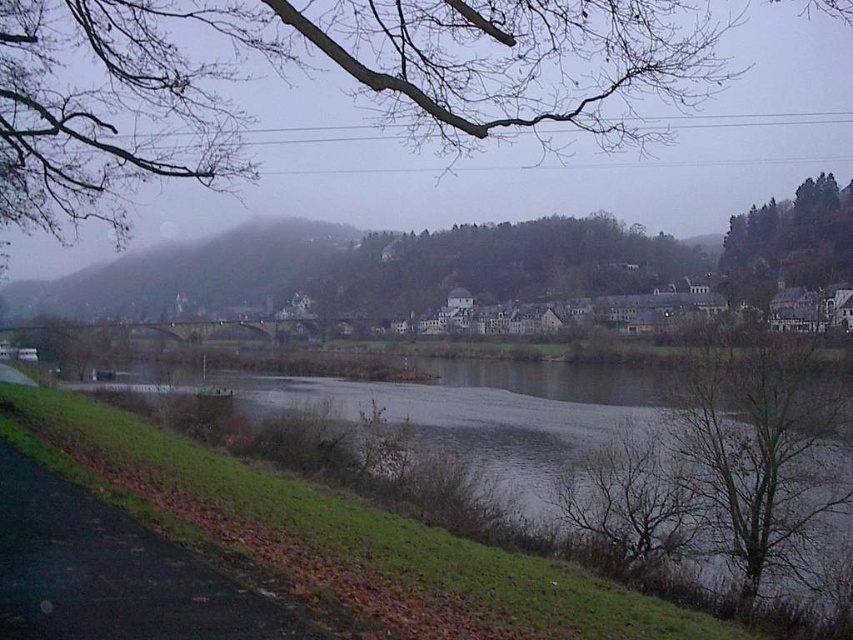
Question: Among these points, which one is nearest to the camera?

Choices:
 (A) (560, 452)
 (B) (848, 269)
 (C) (683, 472)
 (D) (39, 131)

Answer: (D)

Question: Does gray smooth water at lower left appear on the left side of bare branches at lower right?

Choices:
 (A) no
 (B) yes

Answer: (B)

Question: Estimate the real-world distances between objects in this image. Which object is closer to the green leafy tree at upper right?

Choices:
 (A) bare branches at upper center
 (B) bare branches at lower right

Answer: (B)

Question: In this image, where is gray smooth water at lower left located relative to green leafy tree at upper right?

Choices:
 (A) below
 (B) above

Answer: (A)

Question: In this image, where is gray smooth water at lower left located relative to bare branches at lower right?

Choices:
 (A) right
 (B) left

Answer: (B)

Question: Based on their relative distances, which object is farther from the green leafy tree at upper right?

Choices:
 (A) bare branches at lower right
 (B) gray smooth water at lower left
 (C) bare branches at upper center

Answer: (B)